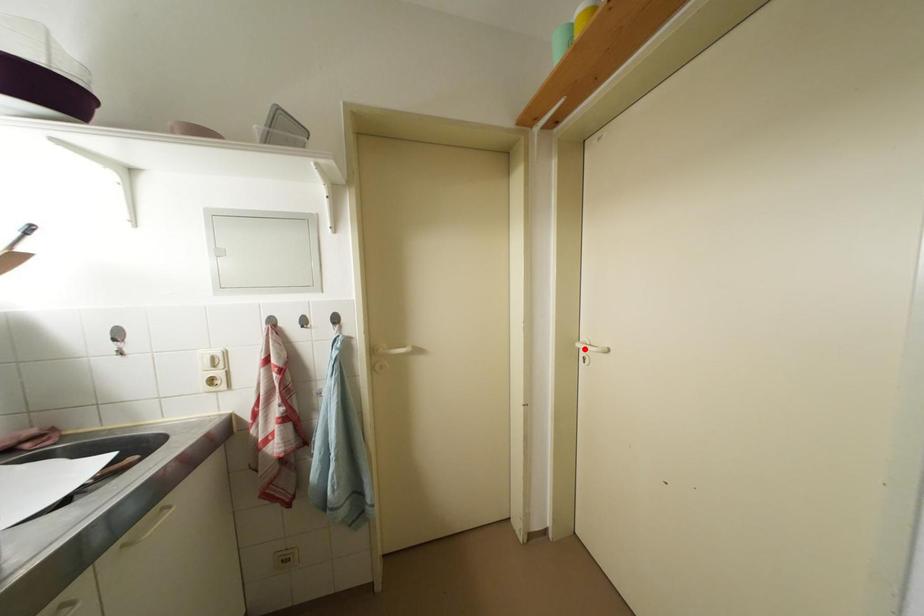
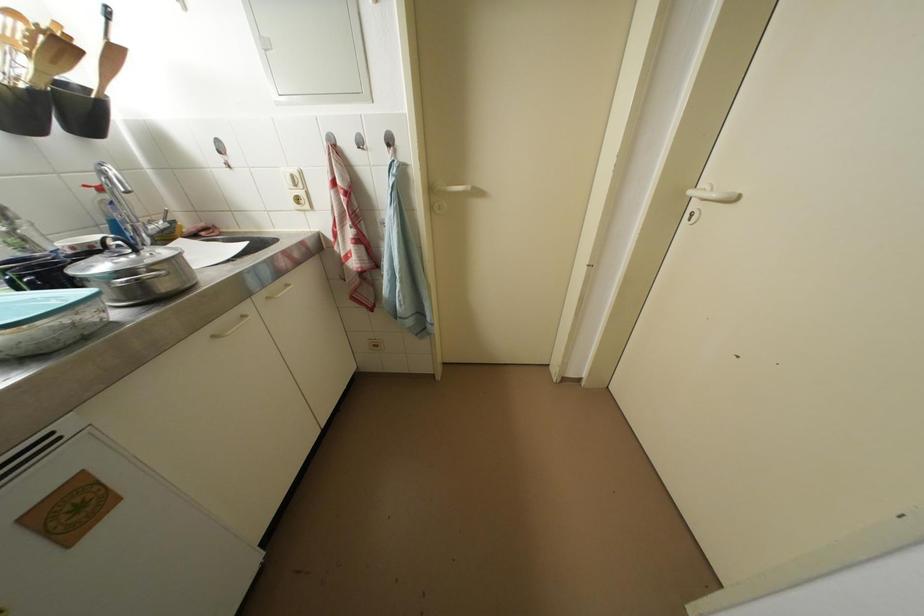
The point at the highlighted location is marked in the first image. Where is the corresponding point in the second image?

(698, 197)